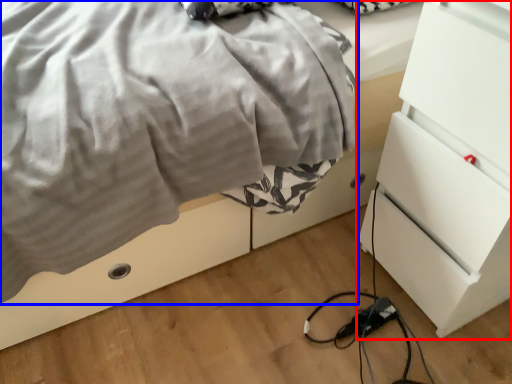
Question: Which object is closer to the camera taking this photo, chest of drawers (highlighted by a red box) or blanket (highlighted by a blue box)?

Choices:
 (A) chest of drawers
 (B) blanket

Answer: (A)